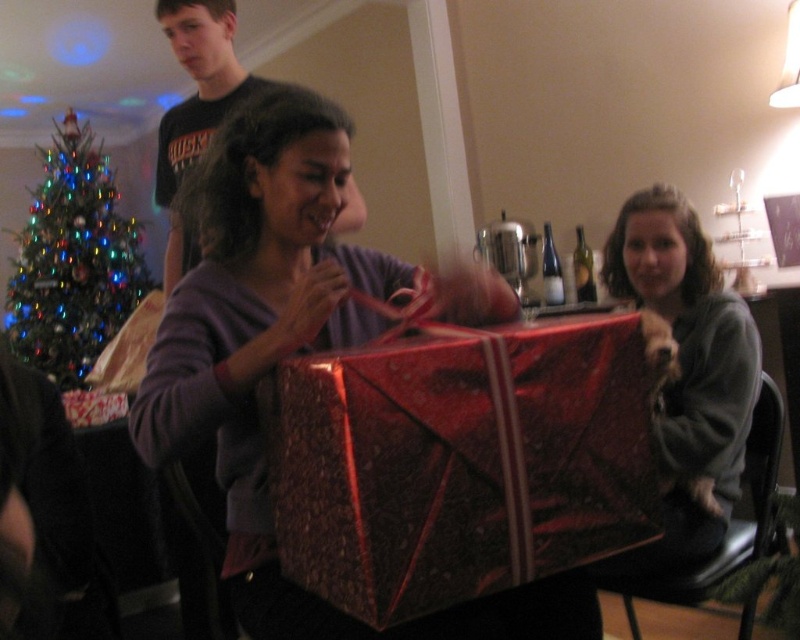
Is matte purple sweater at center taller than gray fleece sweater at right?

Yes.

Who is more distant from viewer, [248,244] or [705,390]?

Point [705,390]

Find the location of a particular element. matte purple sweater at center is located at coordinates (266, 336).

I want to click on matte purple sweater at center, so click(266, 336).

Between matte purple sweater at center and matte black t-shirt at upper left, which one appears on the right side from the viewer's perspective?

matte purple sweater at center

Can you confirm if matte purple sweater at center is shorter than matte black t-shirt at upper left?

A: No, matte purple sweater at center is not shorter than matte black t-shirt at upper left.

Find the location of a particular element. This screenshot has height=640, width=800. matte purple sweater at center is located at coordinates (266, 336).

Locate an element on the screen. matte purple sweater at center is located at coordinates (266, 336).

Where is `matte purple sweater at center`? The image size is (800, 640). matte purple sweater at center is located at coordinates (266, 336).

Does matte purple sweater at center have a greater height compared to green glittering christmas tree at left?

Incorrect, matte purple sweater at center's height is not larger of green glittering christmas tree at left's.

Which is behind, point (172, 452) or point (106, 266)?

The point (106, 266) is behind.

Image resolution: width=800 pixels, height=640 pixels. What are the coordinates of `matte purple sweater at center` in the screenshot? It's located at (266, 336).